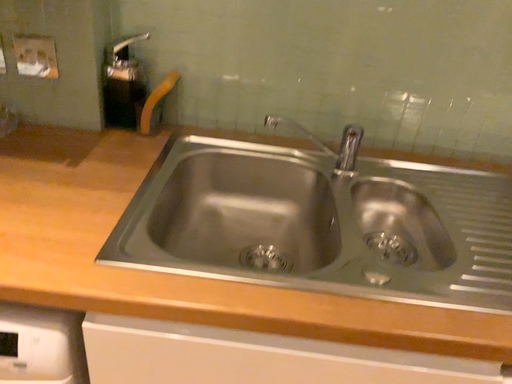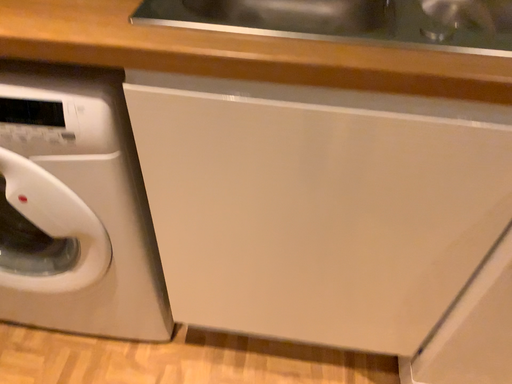
Question: Which way did the camera rotate in the video?

Choices:
 (A) rotated upward
 (B) rotated downward

Answer: (B)